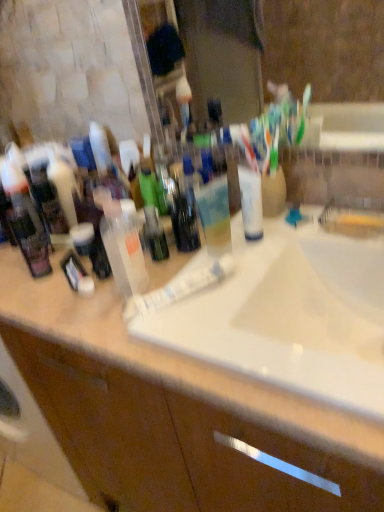
At what (x,y) coordinates should I click in order to perform the action: click on vacant space that is to the left of translucent plastic spray bottle at center. Please return your answer as a coordinate pair (x, y). Looking at the image, I should click on (67, 306).